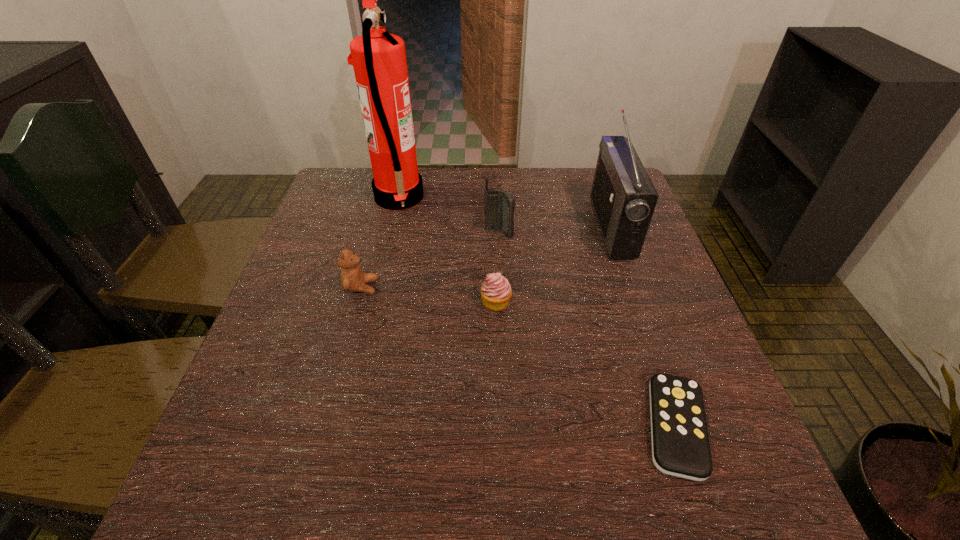
Locate which object is the fourth closest to the fourth shortest object. Please provide its 2D coordinates. Your answer should be formatted as a tuple, i.e. [(x, y)], where the tuple contains the x and y coordinates of a point satisfying the conditions above.

[(352, 278)]

This screenshot has width=960, height=540. In order to click on blank area in the image that satisfies the following two spatial constraints: 1. with the nozzle aimed from the shortest object; 2. on the left side of the tallest object in this screenshot , I will do `click(346, 427)`.

Locate an element on the screen. This screenshot has width=960, height=540. free space that satisfies the following two spatial constraints: 1. on the back side of the nearest object; 2. with the nozzle aimed from the fire extinguisher is located at coordinates (598, 198).

Identify the location of free location that satisfies the following two spatial constraints: 1. on the back side of the nearest object; 2. with the nozzle aimed from the tallest object. (598, 198).

Find the location of `vacant position in the image that satisfies the following two spatial constraints: 1. on the keyboard of the third tallest object; 2. on the face of the third shortest object`. vacant position in the image that satisfies the following two spatial constraints: 1. on the keyboard of the third tallest object; 2. on the face of the third shortest object is located at coordinates (501, 287).

Where is `free spot that satisfies the following two spatial constraints: 1. on the face of the nearest object; 2. on the left side of the third shortest object`? The image size is (960, 540). free spot that satisfies the following two spatial constraints: 1. on the face of the nearest object; 2. on the left side of the third shortest object is located at coordinates (324, 427).

You are a GUI agent. You are given a task and a screenshot of the screen. Output one action in this format:
    pyautogui.click(x=<x>, y=<y>)
    Task: Click on the vacant region that satisfies the following two spatial constraints: 1. on the front-facing side of the second tallest object; 2. on the keyboard of the fourth shortest object
    
    Given the screenshot: What is the action you would take?
    pyautogui.click(x=614, y=234)

Image resolution: width=960 pixels, height=540 pixels. I want to click on free space that satisfies the following two spatial constraints: 1. on the keyboard of the fourth shortest object; 2. on the face of the teddy bear, so click(501, 287).